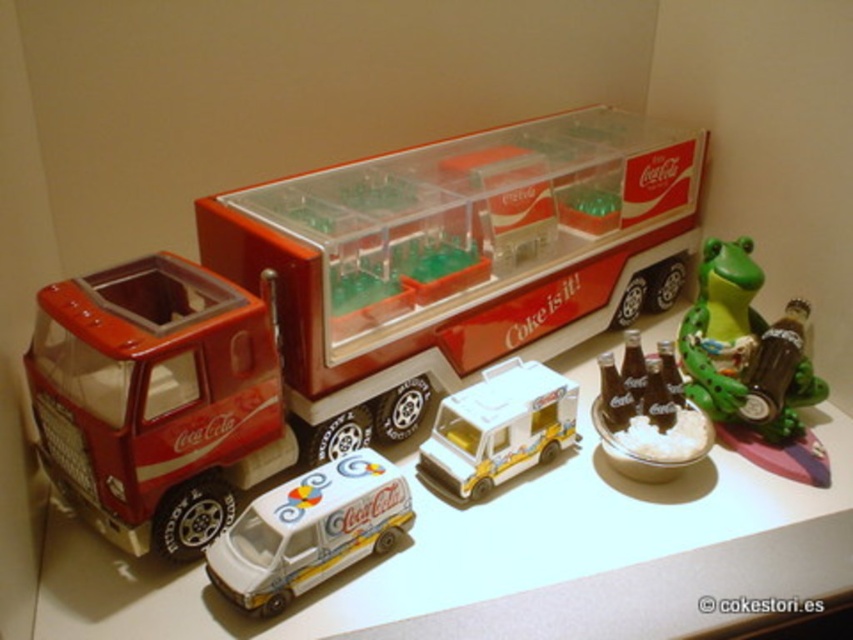
Is matte red coca-cola truck at center wider than white glossy ice cream truck at center?

Correct, the width of matte red coca-cola truck at center exceeds that of white glossy ice cream truck at center.

What are the coordinates of `matte red coca-cola truck at center` in the screenshot? It's located at (347, 310).

Does white glossy table at center appear under green rubber frog at right?

Indeed, white glossy table at center is positioned under green rubber frog at right.

Between point (509, 612) and point (759, 419), which one is positioned in front?

Point (509, 612) is more forward.

Does point (563, 625) come in front of point (691, 339)?

Yes, point (563, 625) is closer to viewer.

Where is `white glossy table at center`? white glossy table at center is located at coordinates (468, 548).

Is matte red coca-cola truck at center positioned in front of green rubber frog at right?

Yes.

Can you confirm if matte red coca-cola truck at center is positioned above green rubber frog at right?

Indeed, matte red coca-cola truck at center is positioned over green rubber frog at right.

Is point (288, 448) positioned in front of point (741, 307)?

Yes, point (288, 448) is in front of point (741, 307).

In order to click on matte red coca-cola truck at center in this screenshot , I will do 347,310.